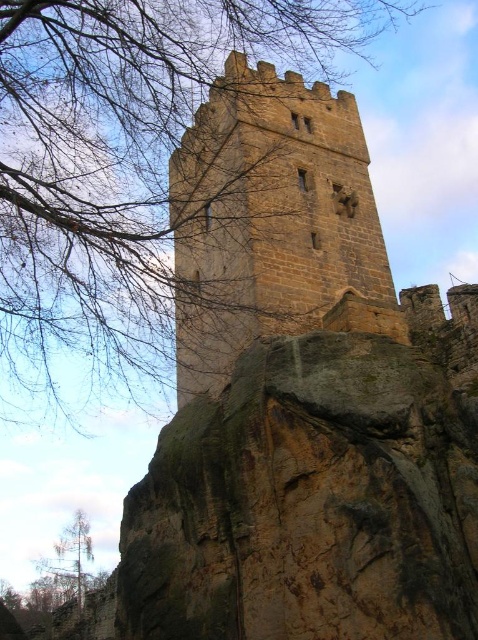
Question: Can you confirm if bare branches at upper left is positioned to the left of brown stone tower at center?

Choices:
 (A) yes
 (B) no

Answer: (A)

Question: Which point is farther from the camera taking this photo?

Choices:
 (A) (238, 161)
 (B) (2, 115)

Answer: (A)

Question: Observing the image, what is the correct spatial positioning of bare branches at upper left in reference to brown stone tower at center?

Choices:
 (A) above
 (B) below

Answer: (A)

Question: Can you confirm if bare branches at upper left is smaller than brown stone tower at center?

Choices:
 (A) yes
 (B) no

Answer: (B)

Question: Which object is farther from the camera taking this photo?

Choices:
 (A) brown stone tower at center
 (B) bare branches at upper left

Answer: (A)